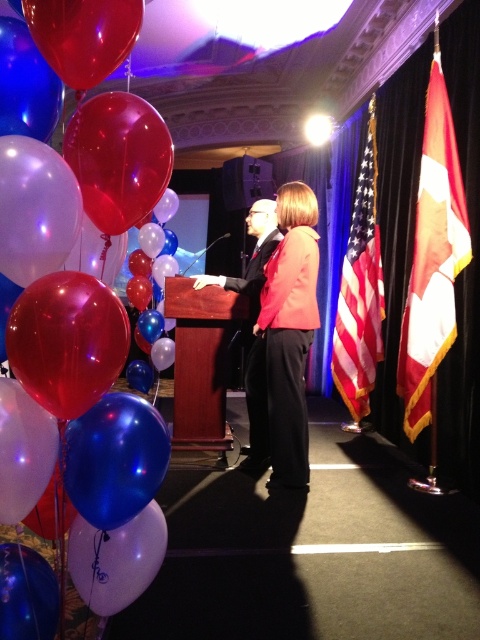
You are a photographer at the event and want to focus on two specific points in the image, point 1 at coordinates point (66,225) and point 2 at coordinates point (252,259). Which point is closer to the camera?

Point (66,225) is closer to the camera than point (252,259).

You are a photographer positioned at the center of the room, aiming to capture the red translucent balloon at left in your shot. Given that your camera has a field of view covering the left half of the image, will the balloon be within your camera frame?

The red translucent balloon at left is located at point (104, 109), which falls within the left half of the image. Since your camera covers the left half, the balloon will be within the frame.